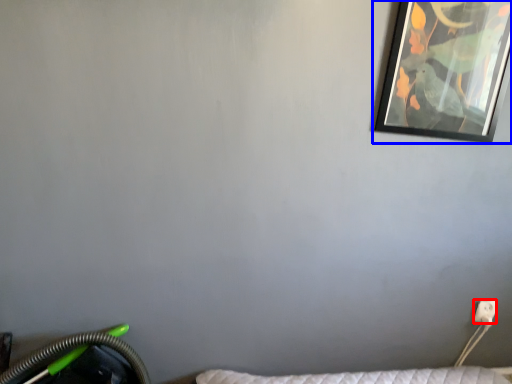
Question: Among these objects, which one is nearest to the camera, electric outlet (highlighted by a red box) or picture frame (highlighted by a blue box)?

Choices:
 (A) electric outlet
 (B) picture frame

Answer: (B)